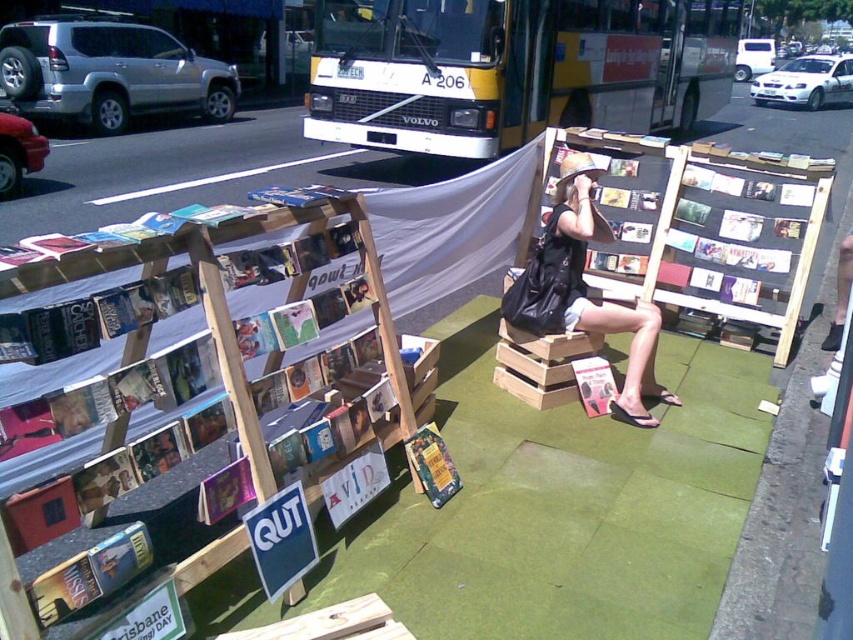
Question: Observing the image, what is the correct spatial positioning of matte black bag at center in reference to hardcover book at center?

Choices:
 (A) right
 (B) left

Answer: (A)

Question: Among these objects, which one is nearest to the camera?

Choices:
 (A) hardcover book at center
 (B) matte pink magazine at center

Answer: (A)

Question: Does hardcover book at center appear over matte pink magazine at center?

Choices:
 (A) no
 (B) yes

Answer: (A)

Question: From the image, what is the correct spatial relationship of hardcover book at center in relation to matte pink magazine at center?

Choices:
 (A) left
 (B) right

Answer: (A)

Question: Among these points, which one is farthest from the camera?

Choices:
 (A) (434, 467)
 (B) (439, 72)

Answer: (B)

Question: Which of the following is the closest to the observer?

Choices:
 (A) (523, 323)
 (B) (577, 381)
 (C) (447, 451)
 (D) (679, 19)

Answer: (C)